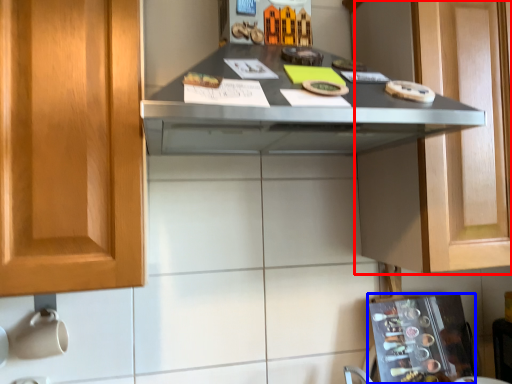
Question: Which of the following is the farthest to the observer, cabinetry (highlighted by a red box) or appliance (highlighted by a blue box)?

Choices:
 (A) cabinetry
 (B) appliance

Answer: (B)